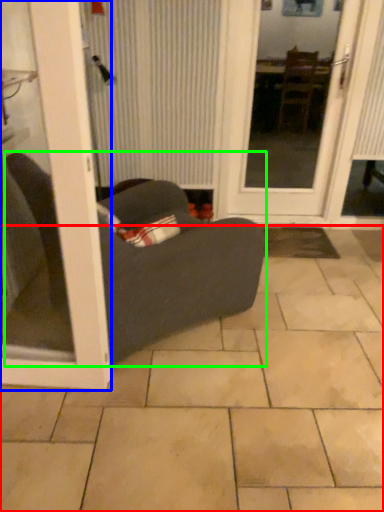
Question: Considering the real-world distances, which object is closest to ceramic tile (highlighted by a red box)? door (highlighted by a blue box) or studio couch (highlighted by a green box).

Choices:
 (A) door
 (B) studio couch

Answer: (B)